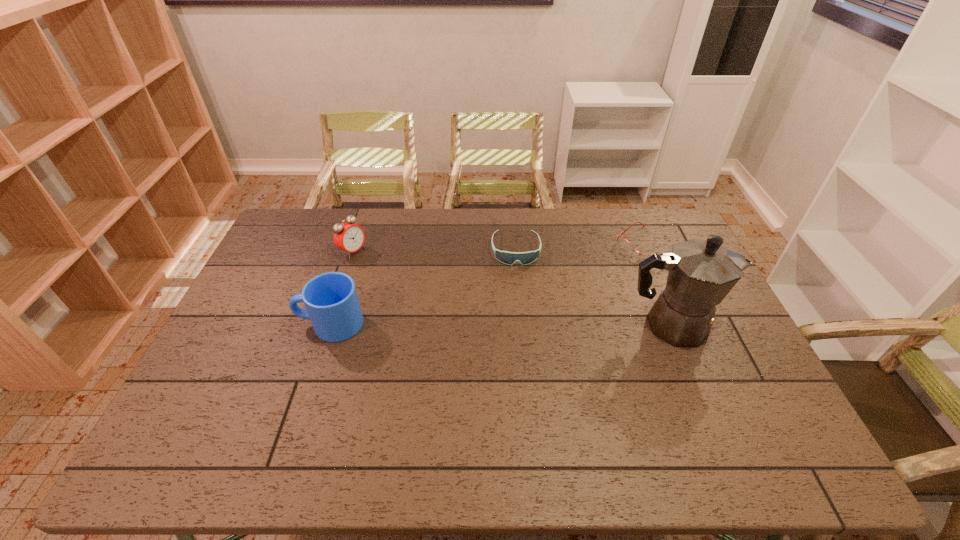
Select which object appears as the fourth closest to the alarm clock. Please provide its 2D coordinates. Your answer should be formatted as a tuple, i.e. [(x, y)], where the tuple contains the x and y coordinates of a point satisfying the conditions above.

[(624, 244)]

Select which object appears as the third closest to the alarm clock. Please provide its 2D coordinates. Your answer should be formatted as a tuple, i.e. [(x, y)], where the tuple contains the x and y coordinates of a point satisfying the conditions above.

[(701, 273)]

I want to click on vacant point that satisfies the following two spatial constraints: 1. on the front side of the coffeepot; 2. on the pouring side of the third object from right to left, so click(x=522, y=325).

This screenshot has height=540, width=960. What are the coordinates of `free space that satisfies the following two spatial constraints: 1. on the front side of the alarm clock; 2. on the side of the mug with the handle` in the screenshot? It's located at (329, 324).